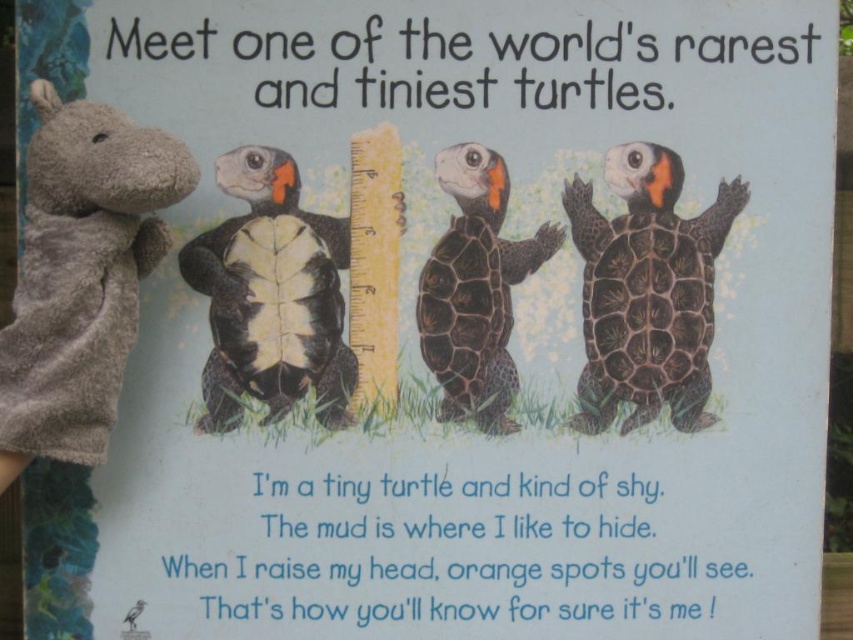
Is point (299, 284) closer to viewer compared to point (424, 314)?

Yes, it is.

Between black matte turtle at center and black textured shell turtle at center, which one has more height?

Standing taller between the two is black textured shell turtle at center.

Is point (305, 300) behind point (491, 353)?

No, it is not.

At what (x,y) coordinates should I click in order to perform the action: click on black matte turtle at center. Please return your answer as a coordinate pair (x, y). The width and height of the screenshot is (853, 640). Looking at the image, I should click on (271, 296).

Is shiny black shell at right shorter than black matte turtle at center?

No.

Is shiny black shell at right to the left of black matte turtle at center from the viewer's perspective?

Incorrect, shiny black shell at right is not on the left side of black matte turtle at center.

Does point (728, 230) lie in front of point (338, 333)?

Yes, point (728, 230) is closer to viewer.

Identify the location of shiny black shell at right. (647, 291).

Who is more distant from viewer, (595, 356) or (556, 236)?

Positioned behind is point (595, 356).

Which of these two, shiny black shell at right or black textured shell turtle at center, stands taller?

black textured shell turtle at center

This screenshot has width=853, height=640. Find the location of `shiny black shell at right`. shiny black shell at right is located at coordinates (647, 291).